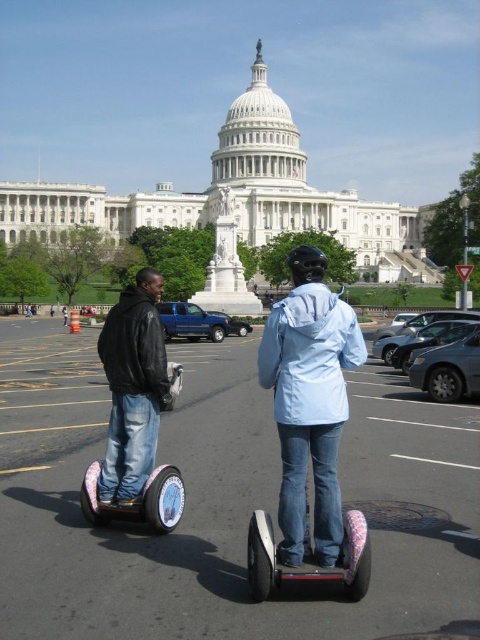
Does light blue fabric jacket at center appear over black leather jacket at left?

Correct, light blue fabric jacket at center is located above black leather jacket at left.

What do you see at coordinates (310, 401) in the screenshot? The width and height of the screenshot is (480, 640). I see `light blue fabric jacket at center` at bounding box center [310, 401].

Is point (288, 444) farther from camera compared to point (111, 460)?

No, (288, 444) is in front of (111, 460).

Locate an element on the screen. The height and width of the screenshot is (640, 480). light blue fabric jacket at center is located at coordinates (310, 401).

From the picture: Does black rubber segway at center appear under light blue fabric jacket at center?

Correct, black rubber segway at center is located below light blue fabric jacket at center.

Is black rubber segway at center closer to camera compared to light blue fabric jacket at center?

Yes, it is in front of light blue fabric jacket at center.

Where is `black rubber segway at center`? This screenshot has height=640, width=480. black rubber segway at center is located at coordinates (224, 502).

You are a GUI agent. You are given a task and a screenshot of the screen. Output one action in this format:
    pyautogui.click(x=<x>, y=<y>)
    Task: Click on the black rubber segway at center
    
    Given the screenshot: What is the action you would take?
    pyautogui.click(x=224, y=502)

What do you see at coordinates (224, 502) in the screenshot? I see `black rubber segway at center` at bounding box center [224, 502].

Is point (87, 412) farther from camera compared to point (116, 504)?

Yes, point (87, 412) is behind point (116, 504).

Is point (317, 605) farther from camera compared to point (144, 454)?

No.

Locate an element on the screen. This screenshot has height=640, width=480. black rubber segway at center is located at coordinates (224, 502).